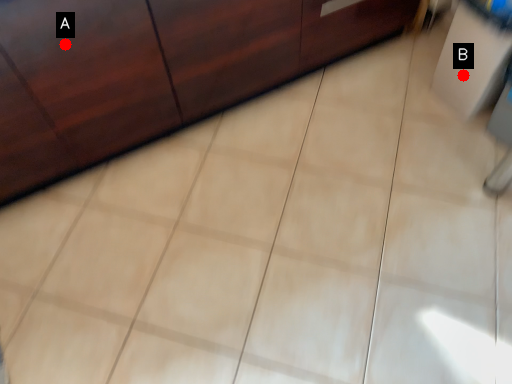
Question: Two points are circled on the image, labeled by A and B beside each circle. Among these points, which one is farthest from the camera?

Choices:
 (A) A is further
 (B) B is further

Answer: (B)